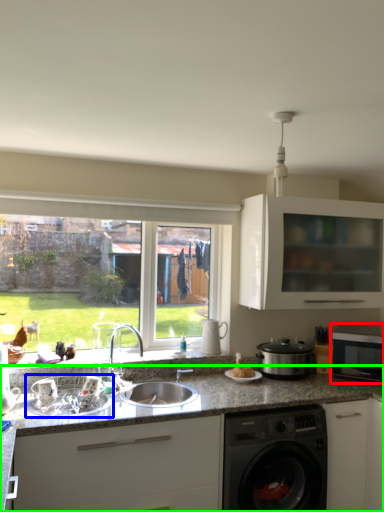
Question: Which object is positioned farthest from microwave oven (highlighted by a red box)? Select from appliance (highlighted by a blue box) and countertop (highlighted by a green box).

Choices:
 (A) appliance
 (B) countertop

Answer: (A)